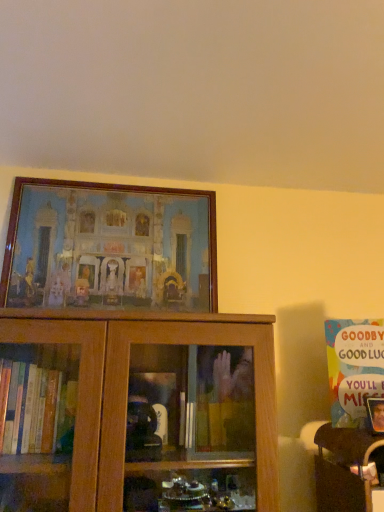
Question: Can you confirm if wooden table at lower right is taller than wooden picture frame at upper center?

Choices:
 (A) no
 (B) yes

Answer: (A)

Question: Does wooden table at lower right have a smaller size compared to wooden picture frame at upper center?

Choices:
 (A) yes
 (B) no

Answer: (A)

Question: Is wooden table at lower right at the right side of wooden picture frame at upper center?

Choices:
 (A) yes
 (B) no

Answer: (A)

Question: From a real-world perspective, is wooden table at lower right below wooden picture frame at upper center?

Choices:
 (A) no
 (B) yes

Answer: (B)

Question: Is wooden table at lower right at the left side of wooden picture frame at upper center?

Choices:
 (A) yes
 (B) no

Answer: (B)

Question: Which is correct: wooden picture frame at upper center is inside wooden table at lower right, or outside of it?

Choices:
 (A) inside
 (B) outside

Answer: (B)

Question: Considering the positions of wooden picture frame at upper center and wooden table at lower right in the image, is wooden picture frame at upper center wider or thinner than wooden table at lower right?

Choices:
 (A) thin
 (B) wide

Answer: (A)

Question: Considering the relative positions of wooden picture frame at upper center and wooden table at lower right in the image provided, is wooden picture frame at upper center to the left or to the right of wooden table at lower right?

Choices:
 (A) left
 (B) right

Answer: (A)

Question: Is wooden picture frame at upper center bigger or smaller than wooden table at lower right?

Choices:
 (A) big
 (B) small

Answer: (A)

Question: Considering the positions of multicolored paper card at upper right and wooden picture frame at upper center in the image, is multicolored paper card at upper right bigger or smaller than wooden picture frame at upper center?

Choices:
 (A) big
 (B) small

Answer: (B)

Question: From a real-world perspective, relative to wooden picture frame at upper center, is multicolored paper card at upper right vertically above or below?

Choices:
 (A) below
 (B) above

Answer: (A)

Question: Is multicolored paper card at upper right taller or shorter than wooden picture frame at upper center?

Choices:
 (A) short
 (B) tall

Answer: (A)

Question: Choose the correct answer: Is multicolored paper card at upper right inside wooden picture frame at upper center or outside it?

Choices:
 (A) inside
 (B) outside

Answer: (B)

Question: In terms of width, does multicolored paper card at upper right look wider or thinner when compared to wooden table at lower right?

Choices:
 (A) wide
 (B) thin

Answer: (B)

Question: Is point (362, 386) positioned closer to the camera than point (352, 436)?

Choices:
 (A) closer
 (B) farther

Answer: (B)